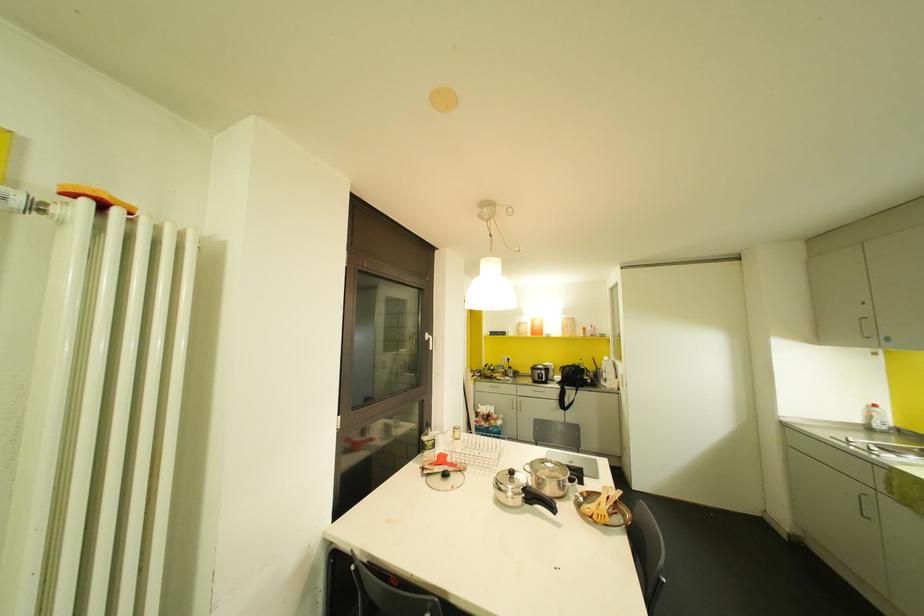
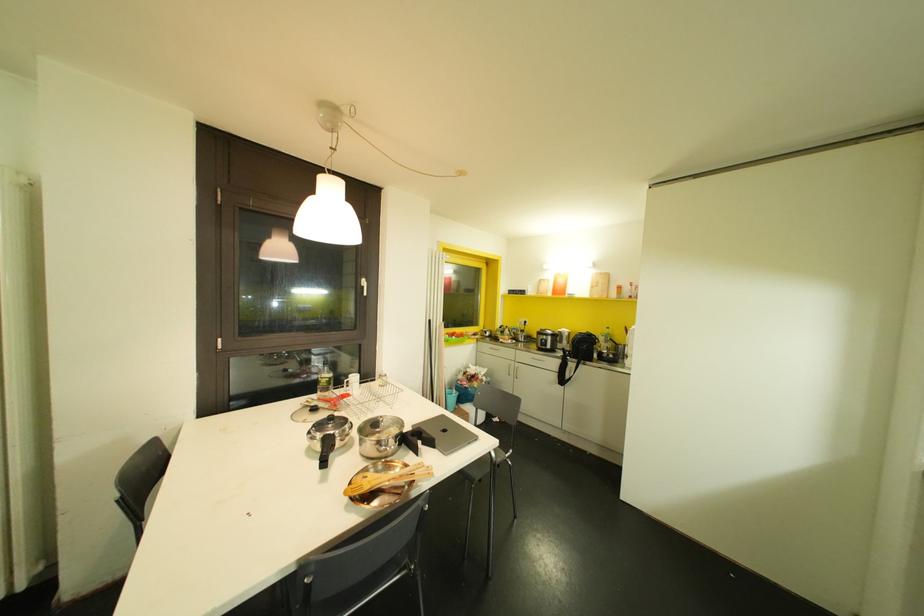
The images are taken continuously from a first-person perspective. In which direction are you moving?

The cameraman moved toward right, forward.